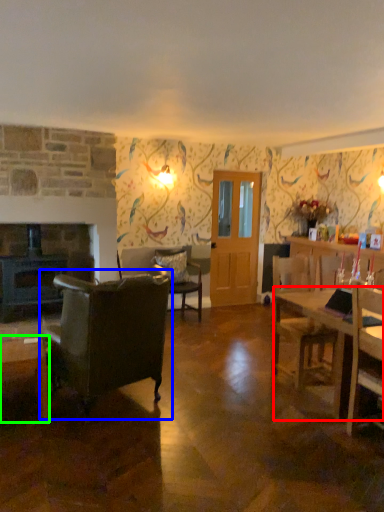
Question: Which is farther away from desk (highlighted by a red box)? chair (highlighted by a blue box) or coffee table (highlighted by a green box)?

Choices:
 (A) chair
 (B) coffee table

Answer: (B)